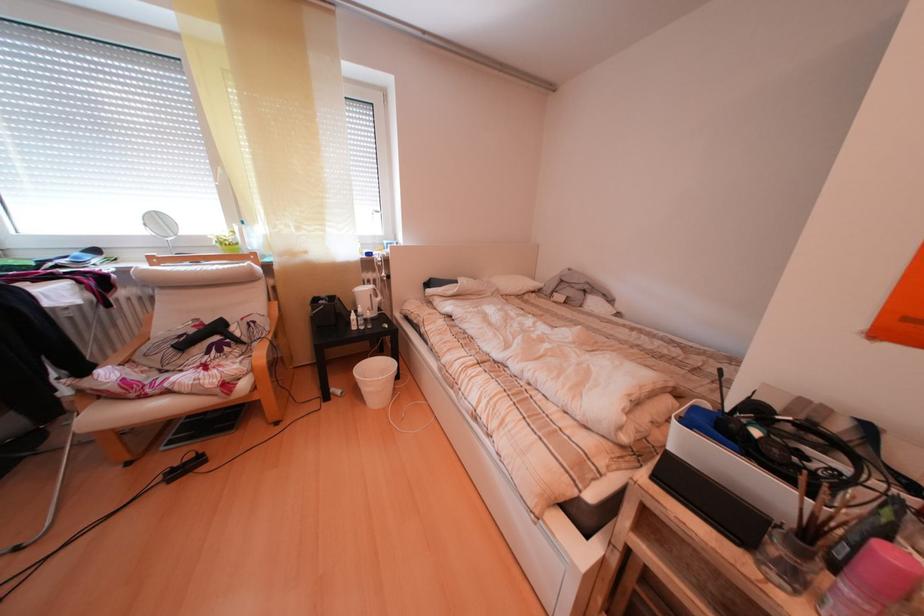
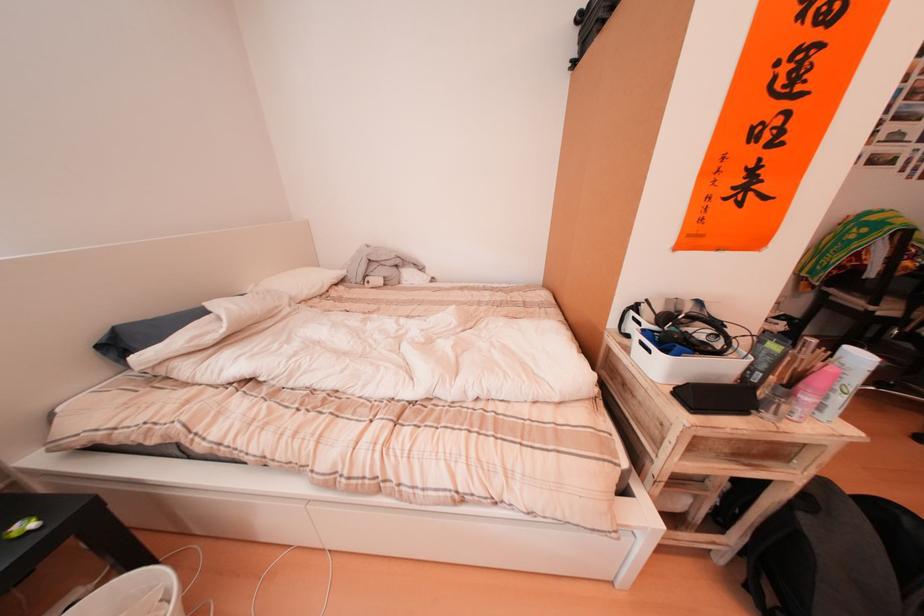
Question: The first image is from the beginning of the video and the second image is from the end. How did the camera likely rotate when shooting the video?

Choices:
 (A) Left
 (B) Right
 (C) Up
 (D) Down

Answer: (B)